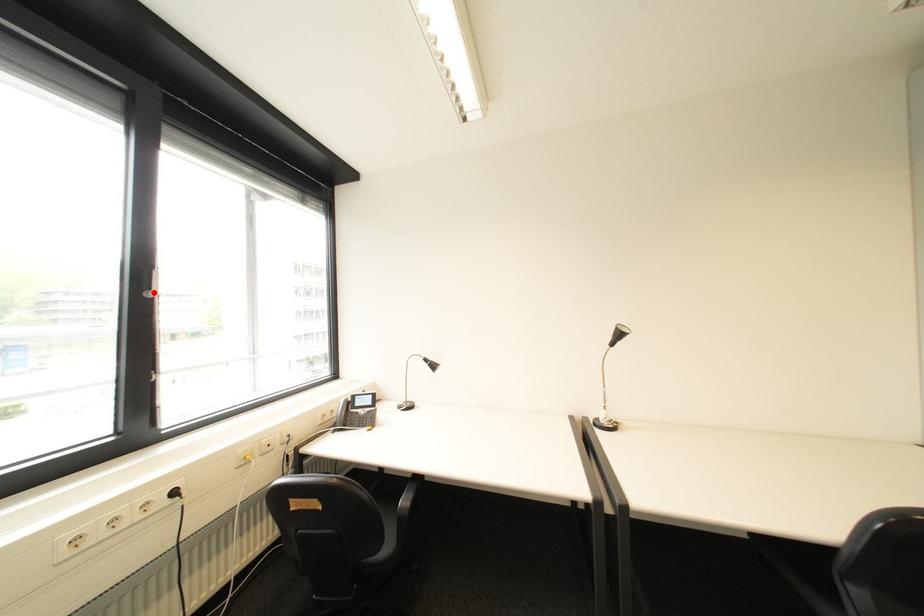
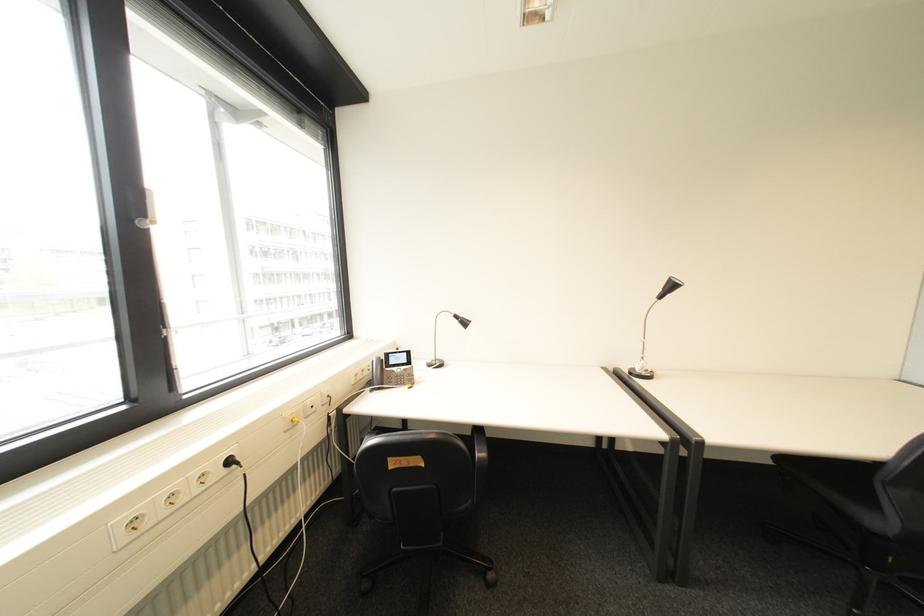
The point at the highlighted location is marked in the first image. Where is the corresponding point in the second image?

(146, 220)